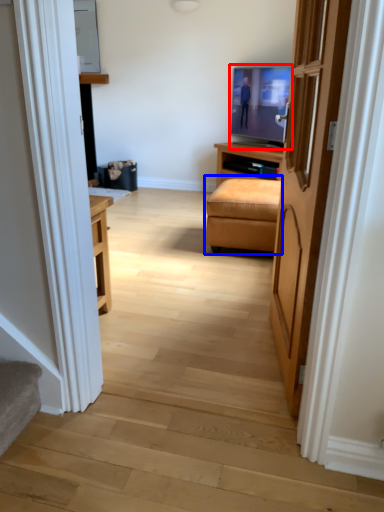
Question: Which of the following is the closest to the observer, television (highlighted by a red box) or studio couch (highlighted by a blue box)?

Choices:
 (A) television
 (B) studio couch

Answer: (B)